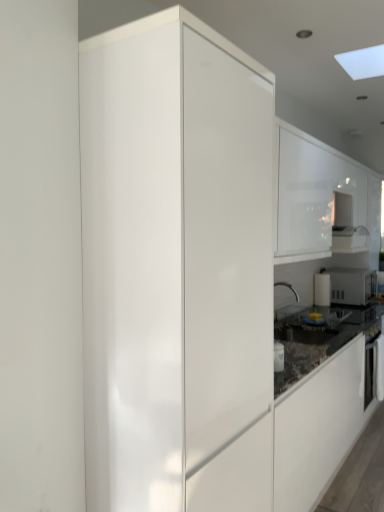
Measure the distance between point (x=303, y=176) and camera.

Point (x=303, y=176) is 2.57 meters from camera.

Where is `black glossy oven at right`? The width and height of the screenshot is (384, 512). black glossy oven at right is located at coordinates (374, 370).

Find the location of a particular element. white glossy microwave at right is located at coordinates (351, 285).

You are a GUI agent. You are given a task and a screenshot of the screen. Output one action in this format:
    pyautogui.click(x=<x>, y=<y>)
    Task: Click on the white glossy cabinet at upper right, arranged as the 2th cabinetry when viewed from the left
    The image size is (384, 512).
    Given the screenshot: What is the action you would take?
    pyautogui.click(x=317, y=195)

Does glossy white cabinet at center, marked as the second cabinetry in a right-to-left arrangement, touch white glossy microwave at right?

No, glossy white cabinet at center, marked as the second cabinetry in a right-to-left arrangement, is not beside white glossy microwave at right.

From the image's perspective, is glossy white cabinet at center, which is the first cabinetry in front-to-back order, over white glossy microwave at right?

Correct, glossy white cabinet at center, which is the first cabinetry in front-to-back order, appears higher than white glossy microwave at right in the image.

Could you tell me if glossy white cabinet at center, which appears as the first cabinetry when viewed from the left, is turned towards white glossy microwave at right?

No, glossy white cabinet at center, which appears as the first cabinetry when viewed from the left, is not oriented towards white glossy microwave at right.

How distant is glossy white cabinet at center, which appears as the first cabinetry when viewed from the left, from white glossy microwave at right?

glossy white cabinet at center, which appears as the first cabinetry when viewed from the left, and white glossy microwave at right are 2.68 meters apart.

Can you tell me how much white glossy microwave at right and black glossy oven at right differ in facing direction?

There is a 0.151-degree angle between the facing directions of white glossy microwave at right and black glossy oven at right.

Based on the photo, is white glossy microwave at right not near black glossy oven at right?

No, white glossy microwave at right is in close proximity to black glossy oven at right.

Considering the relative positions of white glossy microwave at right and black glossy oven at right in the image provided, is white glossy microwave at right to the left or to the right of black glossy oven at right?

white glossy microwave at right is to the right of black glossy oven at right.

Which of these two, white glossy microwave at right or black glossy oven at right, stands shorter?

Standing shorter between the two is white glossy microwave at right.

Based on the photo, is white glossy microwave at right placed right next to white glossy cabinet at upper right, arranged as the 2th cabinetry when viewed from the left?

No, white glossy microwave at right is not in contact with white glossy cabinet at upper right, arranged as the 2th cabinetry when viewed from the left.

This screenshot has width=384, height=512. I want to click on home appliance that is under the white glossy cabinet at upper right, which is the first cabinetry from right to left (from a real-world perspective), so click(351, 285).

Considering the relative sizes of white glossy microwave at right and white glossy cabinet at upper right, which appears as the 2th cabinetry when viewed from the front, in the image provided, is white glossy microwave at right shorter than white glossy cabinet at upper right, which appears as the 2th cabinetry when viewed from the front,?

Indeed, white glossy microwave at right has a lesser height compared to white glossy cabinet at upper right, which appears as the 2th cabinetry when viewed from the front.

Can you tell me how much black glossy oven at right and white glossy microwave at right differ in facing direction?

black glossy oven at right and white glossy microwave at right are facing 0.151 degrees away from each other.

Is black glossy oven at right situated inside white glossy microwave at right or outside?

black glossy oven at right is located beyond the bounds of white glossy microwave at right.

The image size is (384, 512). I want to click on home appliance above the black glossy oven at right (from the image's perspective), so click(351, 285).

Considering the sizes of black glossy oven at right and white glossy microwave at right in the image, is black glossy oven at right taller or shorter than white glossy microwave at right?

black glossy oven at right is taller than white glossy microwave at right.

At what (x,y) coordinates should I click in order to perform the action: click on cabinetry located on the left of white glossy cabinet at upper right, which appears as the 2th cabinetry when viewed from the front. Please return your answer as a coordinate pair (x, y). Looking at the image, I should click on (176, 268).

How much distance is there between white glossy cabinet at upper right, which appears as the 2th cabinetry when viewed from the front, and glossy white cabinet at center, marked as the second cabinetry in a back-to-front arrangement?

white glossy cabinet at upper right, which appears as the 2th cabinetry when viewed from the front, is 1.18 meters away from glossy white cabinet at center, marked as the second cabinetry in a back-to-front arrangement.

Does white glossy cabinet at upper right, which appears as the 2th cabinetry when viewed from the front, come behind glossy white cabinet at center, marked as the second cabinetry in a right-to-left arrangement?

Yes, the depth of white glossy cabinet at upper right, which appears as the 2th cabinetry when viewed from the front, is greater than that of glossy white cabinet at center, marked as the second cabinetry in a right-to-left arrangement.

Do you think white glossy cabinet at upper right, which appears as the 2th cabinetry when viewed from the front, is within glossy white cabinet at center, marked as the second cabinetry in a back-to-front arrangement, or outside of it?

white glossy cabinet at upper right, which appears as the 2th cabinetry when viewed from the front, is located beyond the bounds of glossy white cabinet at center, marked as the second cabinetry in a back-to-front arrangement.

Considering the relative sizes of glossy white cabinet at center, which is the first cabinetry in front-to-back order, and white glossy cabinet at upper right, arranged as the 2th cabinetry when viewed from the left, in the image provided, is glossy white cabinet at center, which is the first cabinetry in front-to-back order, smaller than white glossy cabinet at upper right, arranged as the 2th cabinetry when viewed from the left,?

Actually, glossy white cabinet at center, which is the first cabinetry in front-to-back order, might be larger than white glossy cabinet at upper right, arranged as the 2th cabinetry when viewed from the left.

The height and width of the screenshot is (512, 384). What are the coordinates of `cabinetry above the glossy white cabinet at center, marked as the second cabinetry in a right-to-left arrangement (from a real-world perspective)` in the screenshot? It's located at (317, 195).

In the scene shown: How many degrees apart are the facing directions of glossy white cabinet at center, marked as the second cabinetry in a back-to-front arrangement, and white glossy cabinet at upper right, which appears as the 2th cabinetry when viewed from the front?

They differ by 0.001 degrees in their facing directions.

Can you confirm if glossy white cabinet at center, which appears as the first cabinetry when viewed from the left, is positioned to the right of white glossy cabinet at upper right, arranged as the 1th cabinetry when viewed from the back?

No.

Considering the positions of points (278, 183) and (346, 293), is point (278, 183) farther from camera compared to point (346, 293)?

No.

Looking at their sizes, would you say white glossy cabinet at upper right, arranged as the 1th cabinetry when viewed from the back, is wider or thinner than white glossy microwave at right?

In the image, white glossy cabinet at upper right, arranged as the 1th cabinetry when viewed from the back, appears to be more narrow than white glossy microwave at right.

Is white glossy cabinet at upper right, which appears as the 2th cabinetry when viewed from the front, bigger than white glossy microwave at right?

Indeed, white glossy cabinet at upper right, which appears as the 2th cabinetry when viewed from the front, has a larger size compared to white glossy microwave at right.

Is white glossy cabinet at upper right, arranged as the 1th cabinetry when viewed from the back, inside or outside of white glossy microwave at right?

white glossy cabinet at upper right, arranged as the 1th cabinetry when viewed from the back, is not enclosed by white glossy microwave at right.

In the image, there is a glossy white cabinet at center, marked as the second cabinetry in a right-to-left arrangement. Where is `home appliance below it (from a real-world perspective)`? home appliance below it (from a real-world perspective) is located at coordinates (351, 285).

Where is `home appliance that is above the black glossy oven at right (from the image's perspective)`? Image resolution: width=384 pixels, height=512 pixels. home appliance that is above the black glossy oven at right (from the image's perspective) is located at coordinates (351, 285).

Looking at the image, which one is located further to white glossy microwave at right, glossy white cabinet at center, which is the first cabinetry in front-to-back order, or black glossy oven at right?

glossy white cabinet at center, which is the first cabinetry in front-to-back order.

Which object lies further to the anchor point black glossy oven at right, glossy white cabinet at center, marked as the second cabinetry in a back-to-front arrangement, or white glossy microwave at right?

The object further to black glossy oven at right is glossy white cabinet at center, marked as the second cabinetry in a back-to-front arrangement.

Consider the image. From the image, which object appears to be nearer to black glossy oven at right, white glossy cabinet at upper right, arranged as the 1th cabinetry when viewed from the back, or glossy white cabinet at center, which is the first cabinetry in front-to-back order?

white glossy cabinet at upper right, arranged as the 1th cabinetry when viewed from the back, is closer to black glossy oven at right.

Based on the photo, based on their spatial positions, is white glossy cabinet at upper right, arranged as the 2th cabinetry when viewed from the left, or glossy white cabinet at center, which appears as the first cabinetry when viewed from the left, closer to white glossy microwave at right?

Among the two, white glossy cabinet at upper right, arranged as the 2th cabinetry when viewed from the left, is located nearer to white glossy microwave at right.

Estimate the real-world distances between objects in this image. Which object is further from glossy white cabinet at center, which appears as the first cabinetry when viewed from the left, white glossy microwave at right or black glossy oven at right?

white glossy microwave at right is positioned further to the anchor glossy white cabinet at center, which appears as the first cabinetry when viewed from the left.

When comparing their distances from glossy white cabinet at center, which is the first cabinetry in front-to-back order, does white glossy microwave at right or white glossy cabinet at upper right, arranged as the 1th cabinetry when viewed from the back, seem closer?

white glossy cabinet at upper right, arranged as the 1th cabinetry when viewed from the back, is closer to glossy white cabinet at center, which is the first cabinetry in front-to-back order.

Which object lies nearer to the anchor point glossy white cabinet at center, marked as the second cabinetry in a right-to-left arrangement, black glossy oven at right or white glossy microwave at right?

black glossy oven at right is closer to glossy white cabinet at center, marked as the second cabinetry in a right-to-left arrangement.

Based on their spatial positions, is white glossy microwave at right or glossy white cabinet at center, which appears as the first cabinetry when viewed from the left, closer to black glossy oven at right?

white glossy microwave at right is positioned closer to the anchor black glossy oven at right.

At what (x,y) coordinates should I click in order to perform the action: click on cabinetry between glossy white cabinet at center, which is the first cabinetry in front-to-back order, and white glossy microwave at right from front to back. Please return your answer as a coordinate pair (x, y). Looking at the image, I should click on (317, 195).

Where is `oven positioned between white glossy cabinet at upper right, arranged as the 2th cabinetry when viewed from the left, and white glossy microwave at right from near to far`? Image resolution: width=384 pixels, height=512 pixels. oven positioned between white glossy cabinet at upper right, arranged as the 2th cabinetry when viewed from the left, and white glossy microwave at right from near to far is located at coordinates (374, 370).

The height and width of the screenshot is (512, 384). Find the location of `oven between glossy white cabinet at center, marked as the second cabinetry in a right-to-left arrangement, and white glossy microwave at right from front to back`. oven between glossy white cabinet at center, marked as the second cabinetry in a right-to-left arrangement, and white glossy microwave at right from front to back is located at coordinates (374, 370).

At what (x,y) coordinates should I click in order to perform the action: click on cabinetry positioned between glossy white cabinet at center, which appears as the first cabinetry when viewed from the left, and black glossy oven at right from near to far. Please return your answer as a coordinate pair (x, y). The height and width of the screenshot is (512, 384). Looking at the image, I should click on (317, 195).